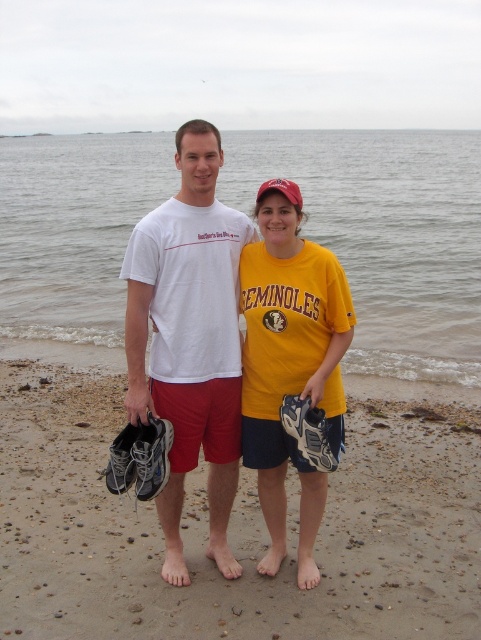
You are a photographer trying to capture the two points in the image. Which point is closer to the camera, point (222, 224) or point (282, 182)?

Point (222, 224) is closer to the camera than point (282, 182) because it is further to the viewer.